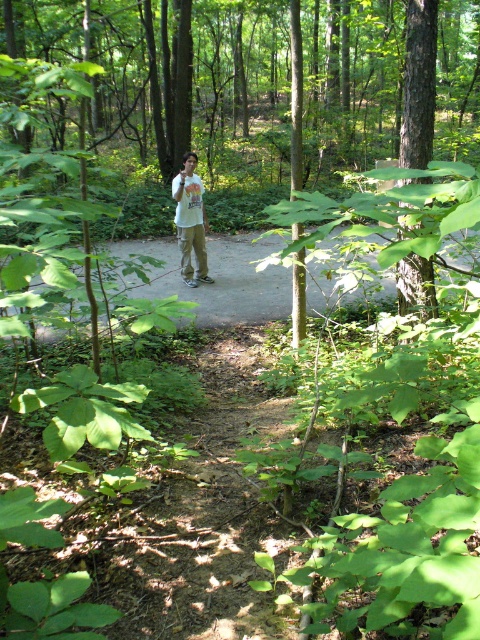
You are standing on the forest path and see two points in the scene. Which point is closer to you, point (x=238, y=305) or point (x=208, y=276)?

Point (x=238, y=305) is closer to the viewer than point (x=208, y=276).

You are a hiker who wants to take a photo of the dirt path at center from the position of the white cotton shirt at center. Can you do this without moving your feet?

The dirt path at center is in front of the white cotton shirt at center, so yes, you can take a photo of the dirt path at center from the current position of the white cotton shirt at center without moving your feet.